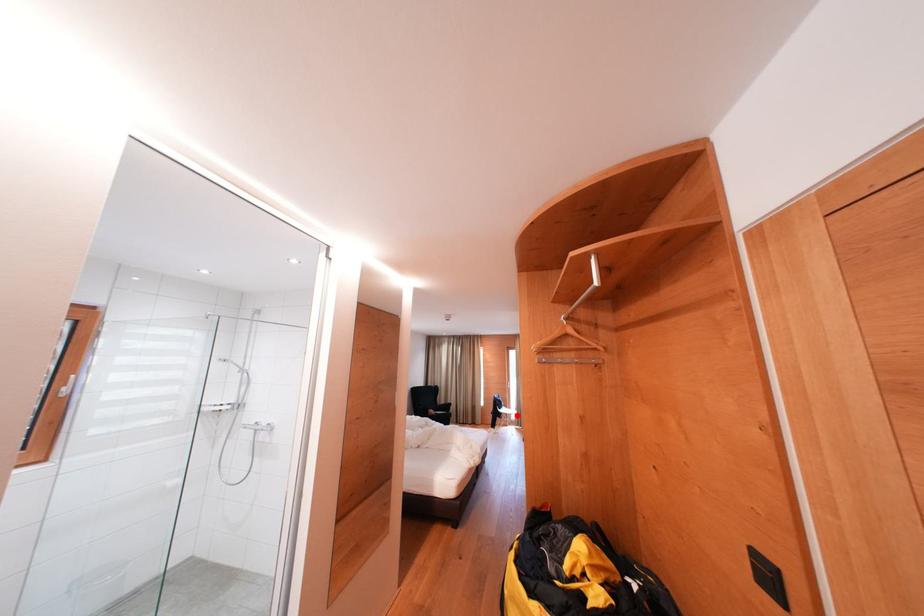
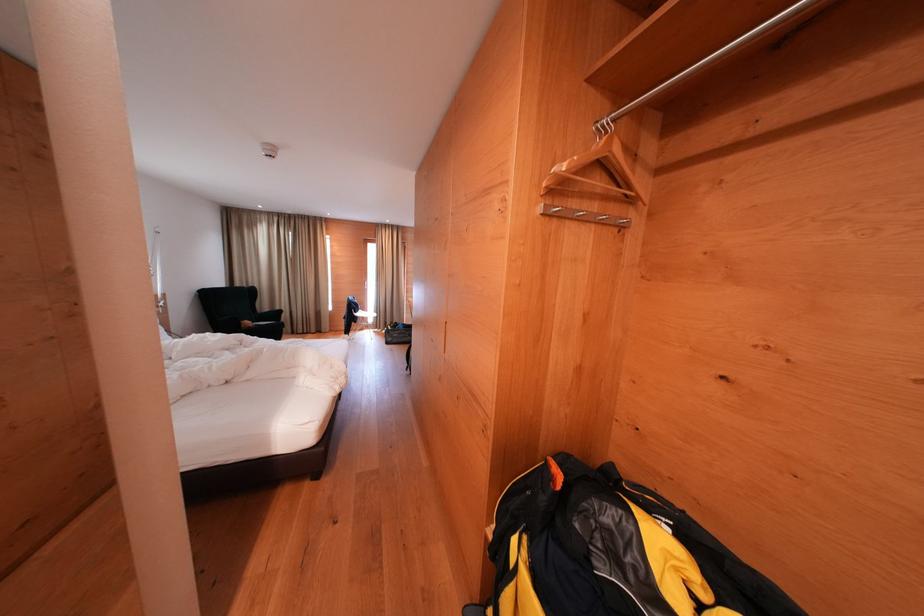
Question: A red point is marked in image1. In image2, is the corresponding 3D point closer to the camera or farther? Reply with the corresponding letter.

Choices:
 (A) The corresponding 3D point is closer.
 (B) The corresponding 3D point is farther.

Answer: (A)